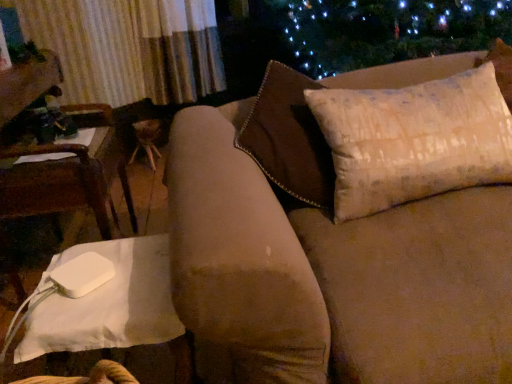
Question: Is white fabric chair at left not within beige textured pillow at upper right?

Choices:
 (A) no
 (B) yes

Answer: (B)

Question: From a real-world perspective, is white fabric chair at left on beige textured pillow at upper right?

Choices:
 (A) no
 (B) yes

Answer: (A)

Question: Considering the relative positions of white fabric chair at left and beige textured pillow at upper right in the image provided, is white fabric chair at left to the right of beige textured pillow at upper right from the viewer's perspective?

Choices:
 (A) yes
 (B) no

Answer: (B)

Question: Can you confirm if white fabric chair at left is smaller than beige textured pillow at upper right?

Choices:
 (A) yes
 (B) no

Answer: (B)

Question: Is white fabric chair at left positioned far away from beige textured pillow at upper right?

Choices:
 (A) no
 (B) yes

Answer: (A)

Question: In terms of height, does white fabric chair at left look taller or shorter compared to beige textured pillow at upper right?

Choices:
 (A) short
 (B) tall

Answer: (B)

Question: Looking at the image, does white fabric chair at left seem bigger or smaller compared to beige textured pillow at upper right?

Choices:
 (A) small
 (B) big

Answer: (B)

Question: From the image's perspective, is white fabric chair at left above or below beige textured pillow at upper right?

Choices:
 (A) above
 (B) below

Answer: (B)

Question: Choose the correct answer: Is white fabric chair at left inside beige textured pillow at upper right or outside it?

Choices:
 (A) inside
 (B) outside

Answer: (B)

Question: From a real-world perspective, is white fabric table at lower left positioned above or below beige textured pillow at upper right?

Choices:
 (A) above
 (B) below

Answer: (B)

Question: Relative to beige textured pillow at upper right, is white fabric table at lower left in front or behind?

Choices:
 (A) behind
 (B) front

Answer: (B)

Question: Is white fabric table at lower left inside the boundaries of beige textured pillow at upper right, or outside?

Choices:
 (A) outside
 (B) inside

Answer: (A)

Question: From the image's perspective, is white fabric table at lower left above or below beige textured pillow at upper right?

Choices:
 (A) below
 (B) above

Answer: (A)

Question: From their relative heights in the image, would you say white fabric chair at left is taller or shorter than suede-like brown couch at upper right?

Choices:
 (A) tall
 (B) short

Answer: (B)

Question: In the image, is white fabric chair at left positioned in front of or behind suede-like brown couch at upper right?

Choices:
 (A) behind
 (B) front

Answer: (A)